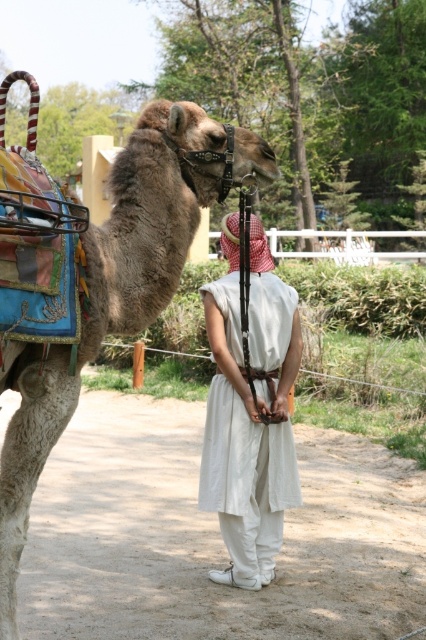
You are a photographer trying to capture a photo of the fuzzy beige camel at center and the white cotton dress at center. Based on their positions, which object is located to the left of the other?

The fuzzy beige camel at center is positioned on the left side of white cotton dress at center.

Looking at this image, A person is standing near the fuzzy beige camel at center. How far apart are they?

The person and the fuzzy beige camel at center are 10.92 feet apart.